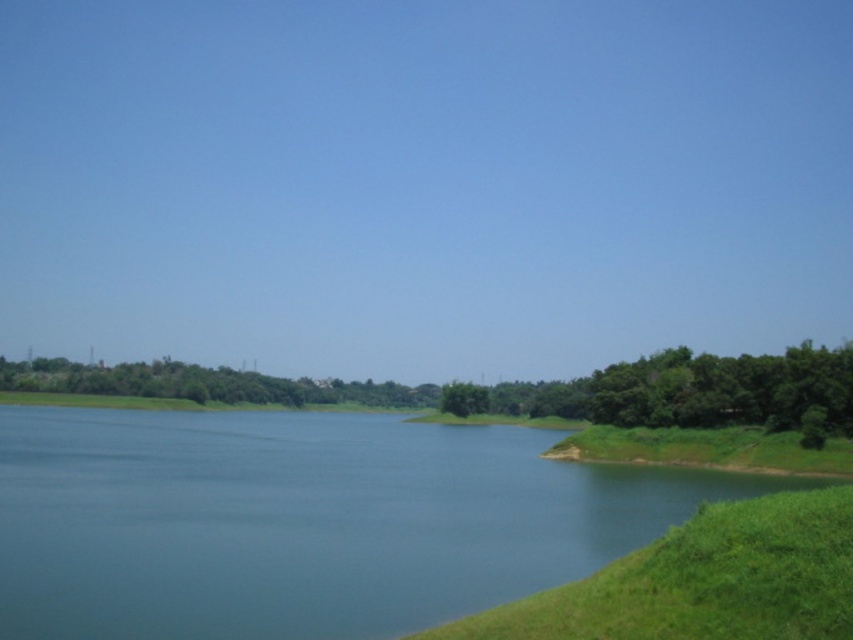
Question: Which point is closer to the camera?

Choices:
 (A) green grassy slope at lower right
 (B) green leafy trees at right
 (C) green leafy trees at center
 (D) blue water at lower left

Answer: (A)

Question: Does blue water at lower left appear under green leafy trees at right?

Choices:
 (A) yes
 (B) no

Answer: (B)

Question: Can you confirm if green leafy trees at center is positioned to the right of green leafy trees at right?

Choices:
 (A) yes
 (B) no

Answer: (B)

Question: Which point is farther to the camera?

Choices:
 (A) (780, 378)
 (B) (572, 609)
 (C) (207, 384)

Answer: (C)

Question: Which point appears farthest from the camera in this image?

Choices:
 (A) (387, 456)
 (B) (659, 355)
 (C) (824, 371)
 (D) (784, 636)

Answer: (B)

Question: Does blue water at lower left appear on the right side of green leafy trees at center?

Choices:
 (A) no
 (B) yes

Answer: (B)